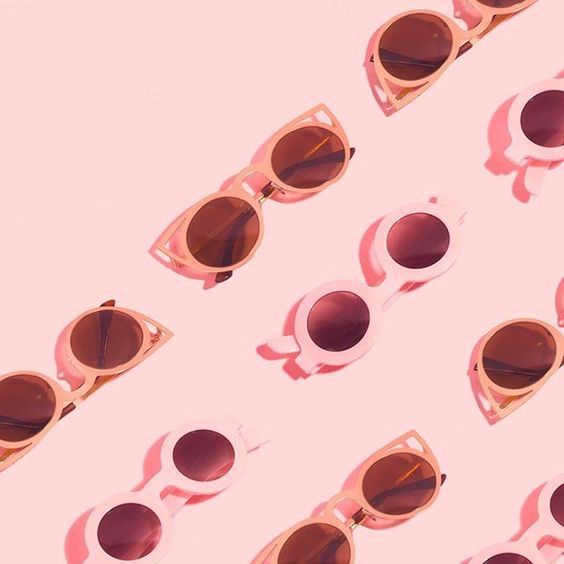
This screenshot has height=564, width=564. Identify the location of peach colored glasses. (81, 395), (251, 173), (474, 30), (337, 502), (549, 372).